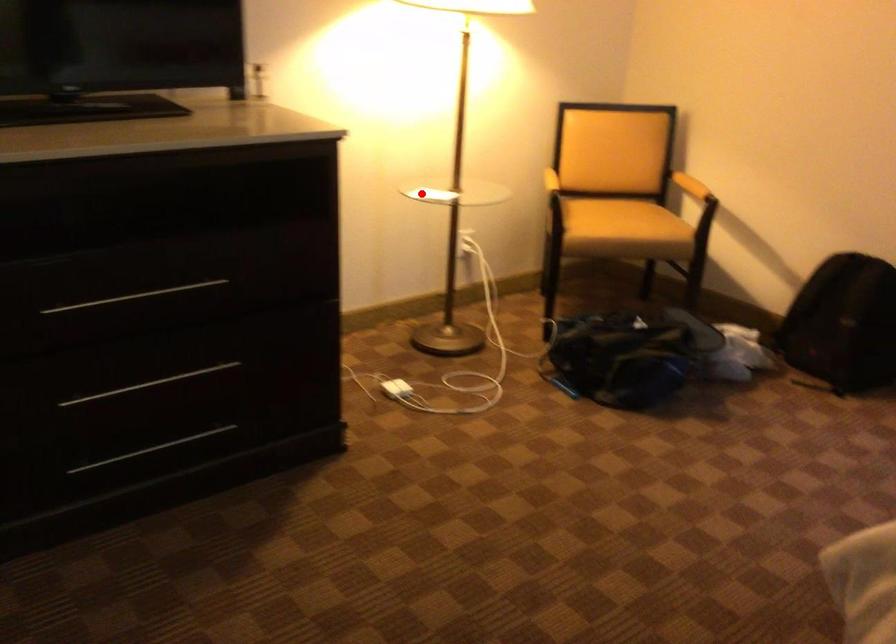
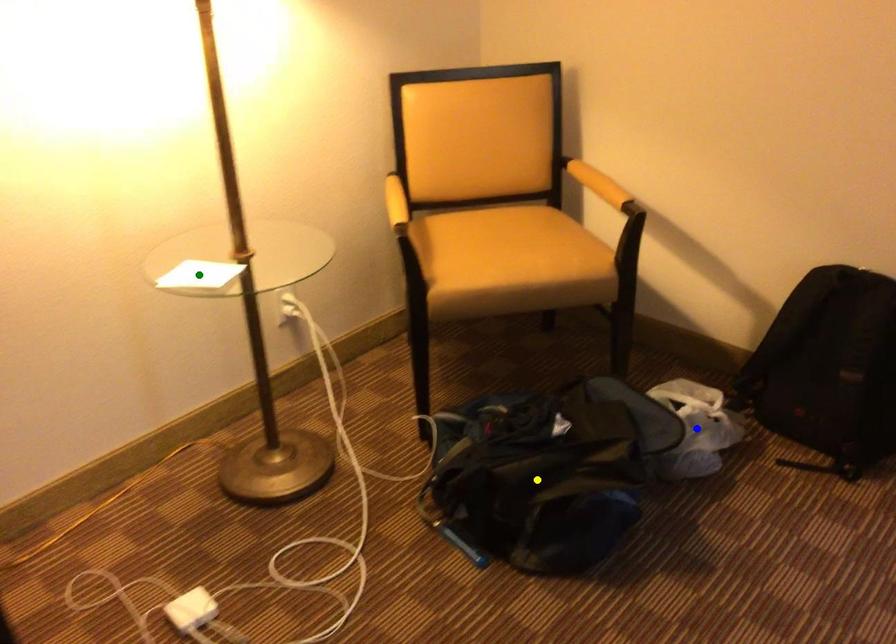
Question: I am providing you with two images of the same scene from different viewpoints. A red point is marked on the first image. You are given multiple points on the second image. Which mark in image 2 goes with the point in image 1?

Choices:
 (A) blue point
 (B) green point
 (C) yellow point

Answer: (B)